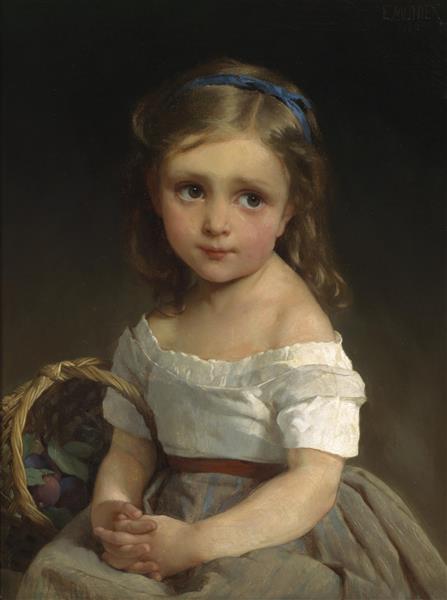
I want to click on basket, so click(59, 368).